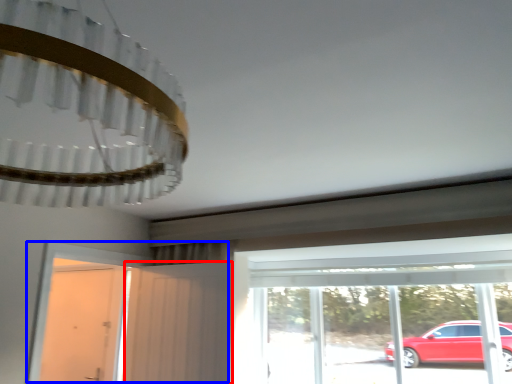
Question: Which object is further to the camera taking this photo, screen door (highlighted by a red box) or door (highlighted by a blue box)?

Choices:
 (A) screen door
 (B) door

Answer: (A)